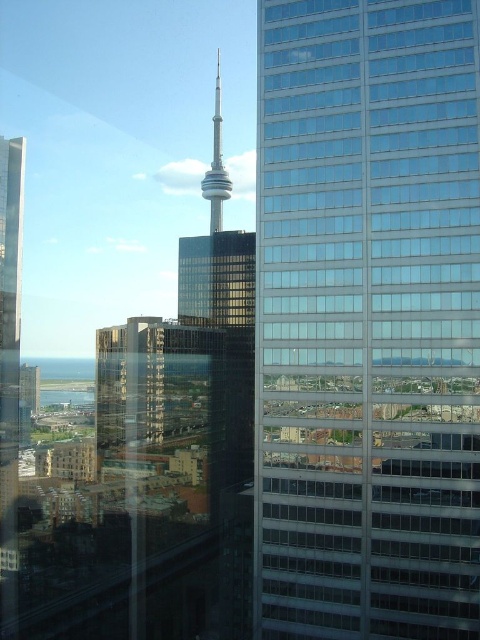
Can you confirm if glassy reflective skyscraper at center is bigger than shiny glass tower at center?

No.

Between glassy reflective skyscraper at center and shiny glass tower at center, which one appears on the right side from the viewer's perspective?

glassy reflective skyscraper at center

Identify the location of glassy reflective skyscraper at center. (367, 321).